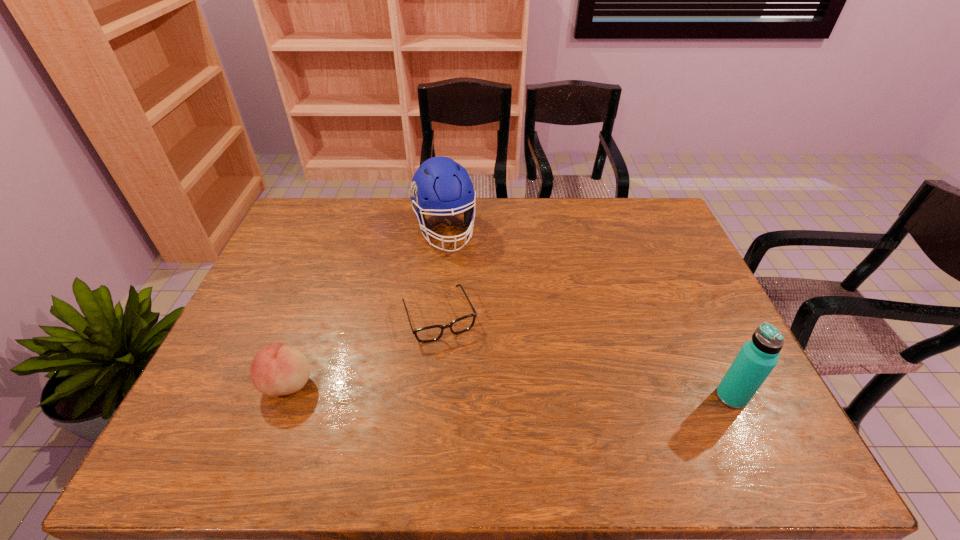
This screenshot has width=960, height=540. I want to click on object present at the near right corner, so click(757, 358).

In the image, there is a desktop. Where is `vacant region at the far edge`? The image size is (960, 540). vacant region at the far edge is located at coordinates (426, 217).

In the image, there is a desktop. At what (x,y) coordinates should I click in order to perform the action: click on blank space at the near edge. Please return your answer as a coordinate pair (x, y). This screenshot has height=540, width=960. Looking at the image, I should click on (535, 414).

Locate an element on the screen. free space at the left edge of the desktop is located at coordinates (269, 277).

In the image, there is a desktop. At what (x,y) coordinates should I click in order to perform the action: click on vacant space at the right edge. Please return your answer as a coordinate pair (x, y). The width and height of the screenshot is (960, 540). Looking at the image, I should click on (703, 340).

In order to click on vacant region at the far left corner of the desktop in this screenshot , I will do `click(309, 218)`.

The image size is (960, 540). In the image, there is a desktop. What are the coordinates of `vacant space at the near left corner` in the screenshot? It's located at (241, 410).

The width and height of the screenshot is (960, 540). What are the coordinates of `vacant region at the far right corner of the desktop` in the screenshot? It's located at (643, 232).

Where is `free spot at the near right corner of the desktop`? The width and height of the screenshot is (960, 540). free spot at the near right corner of the desktop is located at coordinates (722, 403).

The width and height of the screenshot is (960, 540). I want to click on free point between the farthest object and the third nearest object, so click(442, 273).